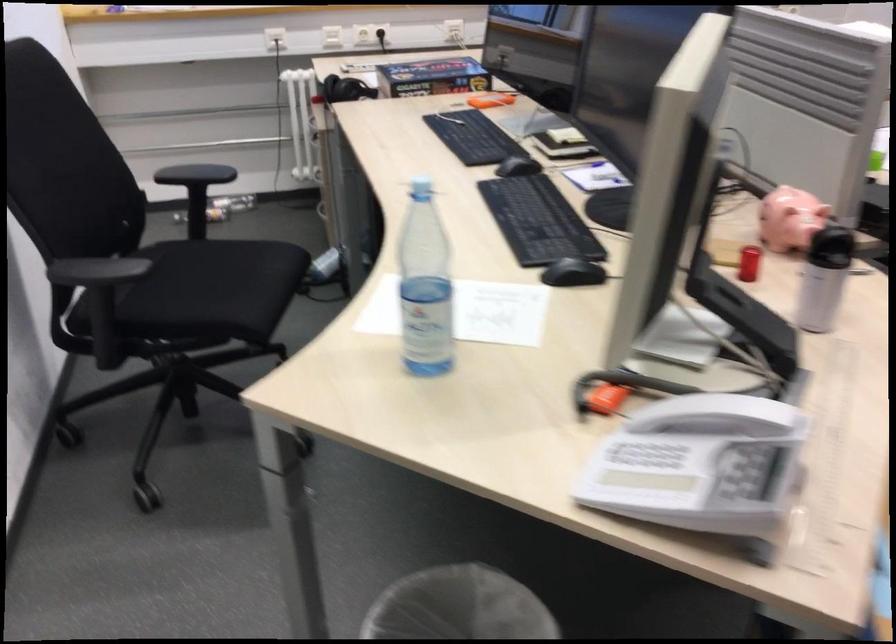
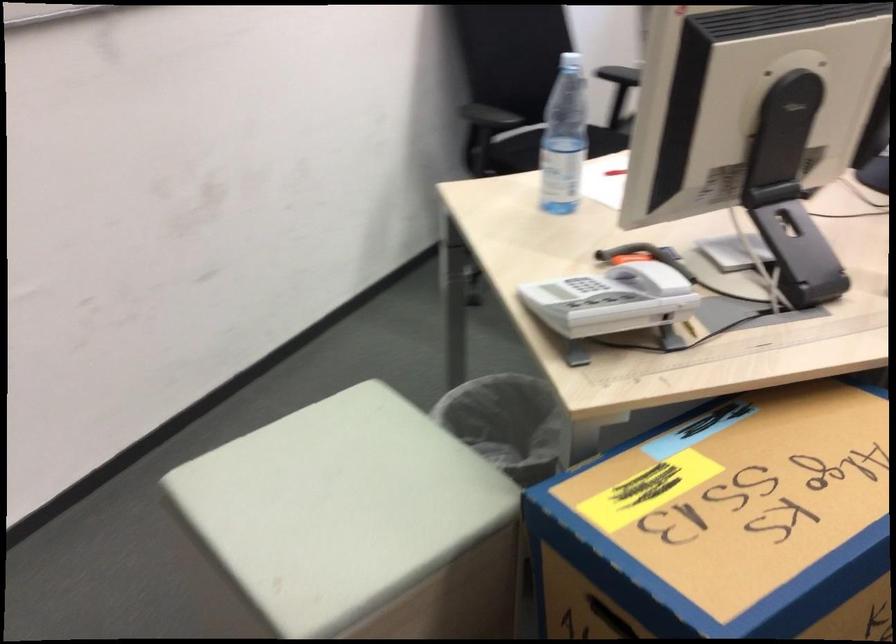
Locate, in the second image, the point that corresponds to [802,422] in the first image.

(746, 334)